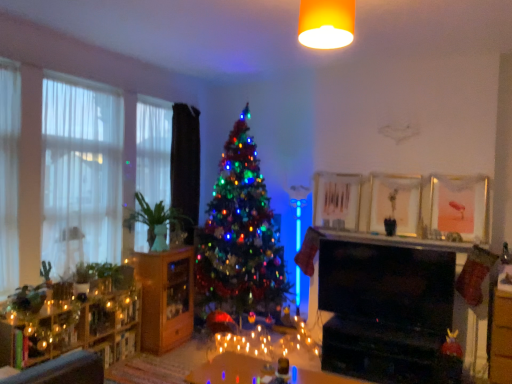
In the scene shown: How much space does metallic gold picture frame at upper center, placed as the 1th picture frame when sorted from left to right, occupy horizontally?

metallic gold picture frame at upper center, placed as the 1th picture frame when sorted from left to right, is 4.16 inches in width.

What do you see at coordinates (81, 174) in the screenshot? I see `white sheer curtains at left, positioned as the second window in right-to-left order` at bounding box center [81, 174].

Locate an element on the screen. The height and width of the screenshot is (384, 512). yellow matte light fixture at upper center is located at coordinates [326, 23].

Where is `white sheer curtain at left, arranged as the first window when viewed from the back`? The image size is (512, 384). white sheer curtain at left, arranged as the first window when viewed from the back is located at coordinates (153, 149).

Choose the correct answer: Is black fabric curtain at left inside white sheer curtains at left, positioned as the second window in right-to-left order, or outside it?

black fabric curtain at left is not inside white sheer curtains at left, positioned as the second window in right-to-left order, it's outside.

Looking at this image, from the image's perspective, who appears lower, black fabric curtain at left or white sheer curtains at left, marked as the 1th window in a front-to-back arrangement?

white sheer curtains at left, marked as the 1th window in a front-to-back arrangement, appears lower in the image.

In the scene shown: Considering the positions of objects black fabric curtain at left and white sheer curtains at left, positioned as the second window in right-to-left order, in the image provided, who is more to the right, black fabric curtain at left or white sheer curtains at left, positioned as the second window in right-to-left order,?

Positioned to the right is black fabric curtain at left.

From the picture: Is there a large distance between black fabric curtain at left and white sheer curtains at left, the 2th window when ordered from back to front?

Yes, black fabric curtain at left is far from white sheer curtains at left, the 2th window when ordered from back to front.

Is metallic gold picture frame at upper center, placed as the 1th picture frame when sorted from left to right, thinner than green matte vase at left, which appears as the first plant when viewed from the top?

Yes, metallic gold picture frame at upper center, placed as the 1th picture frame when sorted from left to right, is thinner than green matte vase at left, which appears as the first plant when viewed from the top.

Where is `the 2nd picture frame located above the green matte vase at left, which appears as the first plant when viewed from the top (from a real-world perspective)`? The height and width of the screenshot is (384, 512). the 2nd picture frame located above the green matte vase at left, which appears as the first plant when viewed from the top (from a real-world perspective) is located at coordinates (395, 204).

How many degrees apart are the facing directions of metallic gold picture frame at upper center, which ranks as the second picture frame in right-to-left order, and green matte vase at left, which appears as the 2th plant when ordered from the bottom?

The angular difference between metallic gold picture frame at upper center, which ranks as the second picture frame in right-to-left order, and green matte vase at left, which appears as the 2th plant when ordered from the bottom, is 89.3 degrees.

Are metallic gold picture frame at upper center, placed as the 1th picture frame when sorted from left to right, and green matte vase at left, which appears as the 2th plant when ordered from the bottom, far apart?

Indeed, metallic gold picture frame at upper center, placed as the 1th picture frame when sorted from left to right, is not near green matte vase at left, which appears as the 2th plant when ordered from the bottom.

Is the surface of pink matte picture frame at upper right, placed as the first picture frame when sorted from right to left, in direct contact with wooden cabinet at left, arranged as the 1th dresser when viewed from the back?

There is a gap between pink matte picture frame at upper right, placed as the first picture frame when sorted from right to left, and wooden cabinet at left, arranged as the 1th dresser when viewed from the back.

In terms of width, does pink matte picture frame at upper right, acting as the 2th picture frame starting from the left, look wider or thinner when compared to wooden cabinet at left, the second dresser when ordered from front to back?

pink matte picture frame at upper right, acting as the 2th picture frame starting from the left, is thinner than wooden cabinet at left, the second dresser when ordered from front to back.

From the image's perspective, between pink matte picture frame at upper right, placed as the first picture frame when sorted from right to left, and wooden cabinet at left, the second dresser when ordered from front to back, who is located below?

wooden cabinet at left, the second dresser when ordered from front to back.

The image size is (512, 384). Identify the location of the 2nd picture frame in front of the wooden cabinet at left, arranged as the 1th dresser when viewed from the back, starting your count from the anchor. (457, 208).

From the image's perspective, is metallic gold picture frame at upper center, which ranks as the second picture frame in right-to-left order, located above white sheer curtain at left, arranged as the 1th window when viewed from the right?

No, from the image's perspective, metallic gold picture frame at upper center, which ranks as the second picture frame in right-to-left order, is not on top of white sheer curtain at left, arranged as the 1th window when viewed from the right.

In the scene shown: From a real-world perspective, is metallic gold picture frame at upper center, placed as the 1th picture frame when sorted from left to right, located higher than white sheer curtain at left, the 2th window positioned from the front?

No, from a real-world perspective, metallic gold picture frame at upper center, placed as the 1th picture frame when sorted from left to right, is not above white sheer curtain at left, the 2th window positioned from the front.

From the picture: Is metallic gold picture frame at upper center, placed as the 1th picture frame when sorted from left to right, outside of white sheer curtain at left, arranged as the second window when viewed from the left?

Indeed, metallic gold picture frame at upper center, placed as the 1th picture frame when sorted from left to right, is completely outside white sheer curtain at left, arranged as the second window when viewed from the left.

Considering the sizes of objects metallic gold picture frame at upper center, placed as the 1th picture frame when sorted from left to right, and white sheer curtain at left, the 2th window positioned from the front, in the image provided, who is wider, metallic gold picture frame at upper center, placed as the 1th picture frame when sorted from left to right, or white sheer curtain at left, the 2th window positioned from the front,?

Wider between the two is white sheer curtain at left, the 2th window positioned from the front.

Would you say black fabric curtain at left is part of wooden cabinet at left, arranged as the 1th dresser when viewed from the back,'s contents?

No.

Considering the sizes of objects wooden cabinet at left, arranged as the 1th dresser when viewed from the back, and black fabric curtain at left in the image provided, who is taller, wooden cabinet at left, arranged as the 1th dresser when viewed from the back, or black fabric curtain at left?

black fabric curtain at left.

Is wooden cabinet at left, arranged as the 1th dresser when viewed from the back, directly adjacent to black fabric curtain at left?

No, wooden cabinet at left, arranged as the 1th dresser when viewed from the back, is not touching black fabric curtain at left.

From a real-world perspective, is wooden cabinet at left, arranged as the 1th dresser when viewed from the back, below black fabric curtain at left?

Yes, from a real-world perspective, wooden cabinet at left, arranged as the 1th dresser when viewed from the back, is under black fabric curtain at left.

From the image's perspective, is white sheer curtain at left, arranged as the first window when viewed from the back, located above or below white sheer curtains at left, the 2th window when ordered from back to front?

Clearly, from the image's perspective, white sheer curtain at left, arranged as the first window when viewed from the back, is above white sheer curtains at left, the 2th window when ordered from back to front.

From a real-world perspective, is white sheer curtain at left, the 2th window positioned from the front, over white sheer curtains at left, marked as the 1th window in a front-to-back arrangement?

Yes, from a real-world perspective, white sheer curtain at left, the 2th window positioned from the front, is above white sheer curtains at left, marked as the 1th window in a front-to-back arrangement.

Can you confirm if white sheer curtain at left, arranged as the first window when viewed from the back, is smaller than white sheer curtains at left, which is counted as the first window, starting from the left?

Yes.

Is white sheer curtain at left, arranged as the first window when viewed from the back, shorter than white sheer curtains at left, which is counted as the first window, starting from the left?

Correct, white sheer curtain at left, arranged as the first window when viewed from the back, is not as tall as white sheer curtains at left, which is counted as the first window, starting from the left.

Is white sheer curtain at left, the 2th window positioned from the front, surrounding wooden shelves at left, which ranks as the 2th dresser in back-to-front order?

No, wooden shelves at left, which ranks as the 2th dresser in back-to-front order, is not inside white sheer curtain at left, the 2th window positioned from the front.

Can you tell me how much white sheer curtain at left, the 2th window positioned from the front, and wooden shelves at left, which ranks as the 2th dresser in back-to-front order, differ in facing direction?

They differ by 1.62 degrees in their facing directions.

Can you confirm if white sheer curtain at left, arranged as the 1th window when viewed from the right, is positioned to the right of wooden shelves at left, which ranks as the 2th dresser in back-to-front order?

Yes.

Is the depth of white sheer curtain at left, arranged as the 1th window when viewed from the right, greater than that of wooden shelves at left, which ranks as the 2th dresser in back-to-front order?

Yes, white sheer curtain at left, arranged as the 1th window when viewed from the right, is further from the camera.

Locate an element on the screen. Image resolution: width=512 pixels, height=384 pixels. curtain behind the white sheer curtains at left, which is counted as the first window, starting from the left is located at coordinates (186, 166).

This screenshot has width=512, height=384. Find the location of `plant that is the 1st object located below the metallic gold picture frame at upper center, which ranks as the second picture frame in right-to-left order (from the image's perspective)`. plant that is the 1st object located below the metallic gold picture frame at upper center, which ranks as the second picture frame in right-to-left order (from the image's perspective) is located at coordinates (153, 216).

Which object lies nearer to the anchor point black fabric curtain at left, translucent glass table at center or metallic gold picture frame at upper center, which ranks as the second picture frame in right-to-left order?

metallic gold picture frame at upper center, which ranks as the second picture frame in right-to-left order, lies closer to black fabric curtain at left than the other object.

When comparing their distances from wooden cabinet at left, arranged as the 1th dresser when viewed from the back, does translucent glass table at center or green matte vase at left, which appears as the 2th plant when ordered from the bottom, seem closer?

Based on the image, green matte vase at left, which appears as the 2th plant when ordered from the bottom, appears to be nearer to wooden cabinet at left, arranged as the 1th dresser when viewed from the back.

Looking at the image, which one is located further to white sheer curtains at left, marked as the 1th window in a front-to-back arrangement, metallic gold picture frame at upper center, placed as the 1th picture frame when sorted from left to right, or black fabric curtain at left?

Based on the image, metallic gold picture frame at upper center, placed as the 1th picture frame when sorted from left to right, appears to be further to white sheer curtains at left, marked as the 1th window in a front-to-back arrangement.

Based on their spatial positions, is green matte plant at left, which appears as the 1th plant when ordered from the bottom, or green matte vase at left, which appears as the first plant when viewed from the top, closer to wooden shelves at left, which ranks as the 1th dresser in front-to-back order?

green matte plant at left, which appears as the 1th plant when ordered from the bottom, lies closer to wooden shelves at left, which ranks as the 1th dresser in front-to-back order, than the other object.

Based on their spatial positions, is black fabric curtain at left or white sheer curtain at left, arranged as the first window when viewed from the back, closer to white sheer curtains at left, the 2th window when ordered from back to front?

white sheer curtain at left, arranged as the first window when viewed from the back, lies closer to white sheer curtains at left, the 2th window when ordered from back to front, than the other object.

From the image, which object appears to be nearer to white sheer curtains at left, positioned as the second window in right-to-left order, wooden shelves at left, which ranks as the 2th dresser in back-to-front order, or metallic gold picture frame at upper center, placed as the 1th picture frame when sorted from left to right?

wooden shelves at left, which ranks as the 2th dresser in back-to-front order, is closer to white sheer curtains at left, positioned as the second window in right-to-left order.

Based on the photo, estimate the real-world distances between objects in this image. Which object is closer to green matte plant at left, the 2th plant when ordered from top to bottom, pink matte picture frame at upper right, acting as the 2th picture frame starting from the left, or translucent glass table at center?

The object closer to green matte plant at left, the 2th plant when ordered from top to bottom, is translucent glass table at center.

When comparing their distances from green matte plant at left, which appears as the 1th plant when ordered from the bottom, does black fabric curtain at left or wooden shelves at left, which ranks as the 1th dresser in front-to-back order, seem closer?

Among the two, wooden shelves at left, which ranks as the 1th dresser in front-to-back order, is located nearer to green matte plant at left, which appears as the 1th plant when ordered from the bottom.

Locate an element on the screen. christmas tree between black fabric curtain at left and pink matte picture frame at upper right, acting as the 2th picture frame starting from the left is located at coordinates (240, 235).

Where is `christmas tree located between yellow matte light fixture at upper center and green matte vase at left, which appears as the 2th plant when ordered from the bottom, in the depth direction`? This screenshot has width=512, height=384. christmas tree located between yellow matte light fixture at upper center and green matte vase at left, which appears as the 2th plant when ordered from the bottom, in the depth direction is located at coordinates (240, 235).

The image size is (512, 384). I want to click on plant between white sheer curtain at left, the 2th window positioned from the front, and metallic gold picture frame at upper center, placed as the 1th picture frame when sorted from left to right, from left to right, so click(153, 216).

You are a GUI agent. You are given a task and a screenshot of the screen. Output one action in this format:
    pyautogui.click(x=<x>, y=<y>)
    Task: Click on the light fixture situated between green matte vase at left, which appears as the 2th plant when ordered from the bottom, and pink matte picture frame at upper right, placed as the first picture frame when sorted from right to left, from left to right
    The height and width of the screenshot is (384, 512).
    Given the screenshot: What is the action you would take?
    pyautogui.click(x=326, y=23)